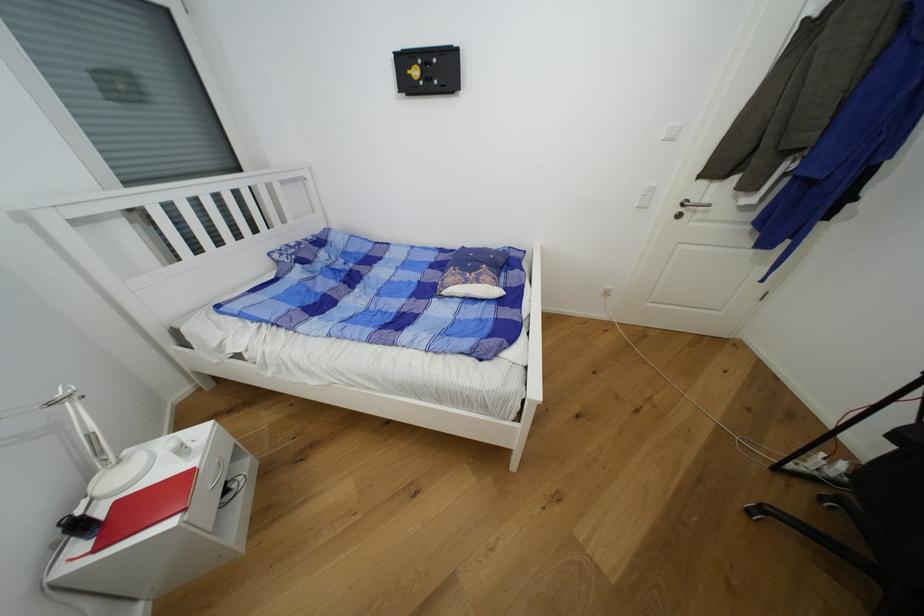
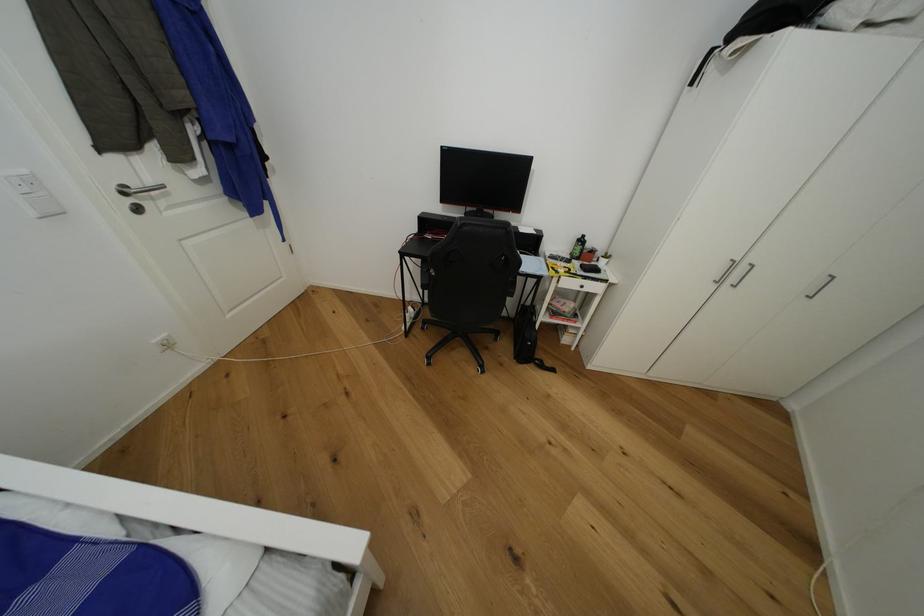
Based on the continuous images, in which direction is the camera rotating?

The camera's rotation is toward right-down.